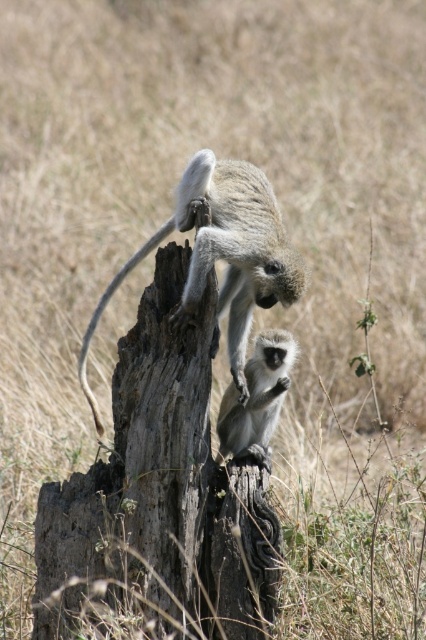
Does gray rough tree trunk at center have a lesser height compared to gray-green fur monkey at center?

In fact, gray rough tree trunk at center may be taller than gray-green fur monkey at center.

Who is more distant from viewer, [175,547] or [226,422]?

The point [226,422] is more distant.

Locate an element on the screen. gray rough tree trunk at center is located at coordinates (164, 449).

Between gray furry monkey at center and gray-green fur monkey at center, which one is positioned lower?

gray-green fur monkey at center

Can you confirm if gray furry monkey at center is positioned to the right of gray-green fur monkey at center?

In fact, gray furry monkey at center is to the left of gray-green fur monkey at center.

Between point (149, 241) and point (267, 358), which one is positioned in front?

Point (267, 358) is more forward.

Image resolution: width=426 pixels, height=640 pixels. Identify the location of gray furry monkey at center. (222, 253).

Can you confirm if gray rough tree trunk at center is shorter than gray furry monkey at center?

No.

Describe the element at coordinates (164, 449) in the screenshot. This screenshot has height=640, width=426. I see `gray rough tree trunk at center` at that location.

Image resolution: width=426 pixels, height=640 pixels. Find the location of `gray rough tree trunk at center`. gray rough tree trunk at center is located at coordinates pos(164,449).